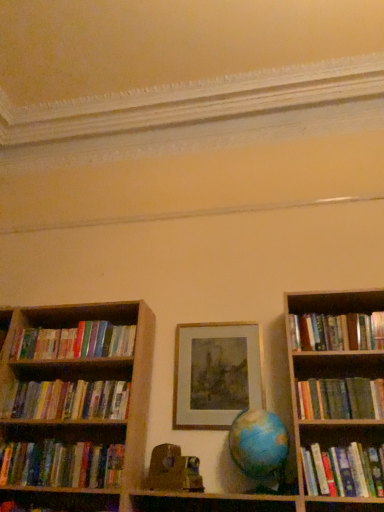
Question: Considering the relative positions of hardcover books at right, which ranks as the 3th book in bottom-to-top order, and hardcover book at lower left, which is counted as the seventh book, starting from the top, in the image provided, is hardcover books at right, which ranks as the 3th book in bottom-to-top order, to the left or to the right of hardcover book at lower left, which is counted as the seventh book, starting from the top,?

Choices:
 (A) right
 (B) left

Answer: (A)

Question: From the image's perspective, is hardcover books at right, which ranks as the 3th book in bottom-to-top order, located above or below hardcover book at lower left, the first book when ordered from bottom to top?

Choices:
 (A) above
 (B) below

Answer: (A)

Question: Which object is the farthest from the hardcover books at left, which is the 6th book in bottom-to-top order?

Choices:
 (A) hardcover books at left, which ranks as the 4th book in bottom-to-top order
 (B) hardcover books at right, which ranks as the fifth book in top-to-bottom order
 (C) hardcover book at lower left, which is counted as the seventh book, starting from the top
 (D) gold metallic picture frame at center
 (E) hardcover books at right, which is counted as the seventh book, starting from the bottom

Answer: (B)

Question: Which of these objects is positioned farthest from the hardcover books at left, which ranks as the 4th book in bottom-to-top order?

Choices:
 (A) hardcover books at left, the sixth book in the top-to-bottom sequence
 (B) hardcover books at right, which ranks as the 3th book in bottom-to-top order
 (C) hardcover book at lower left, which is counted as the seventh book, starting from the top
 (D) hardcover books at right, the first book in the top-to-bottom sequence
 (E) hardcover books at left, which is the 6th book in bottom-to-top order

Answer: (D)